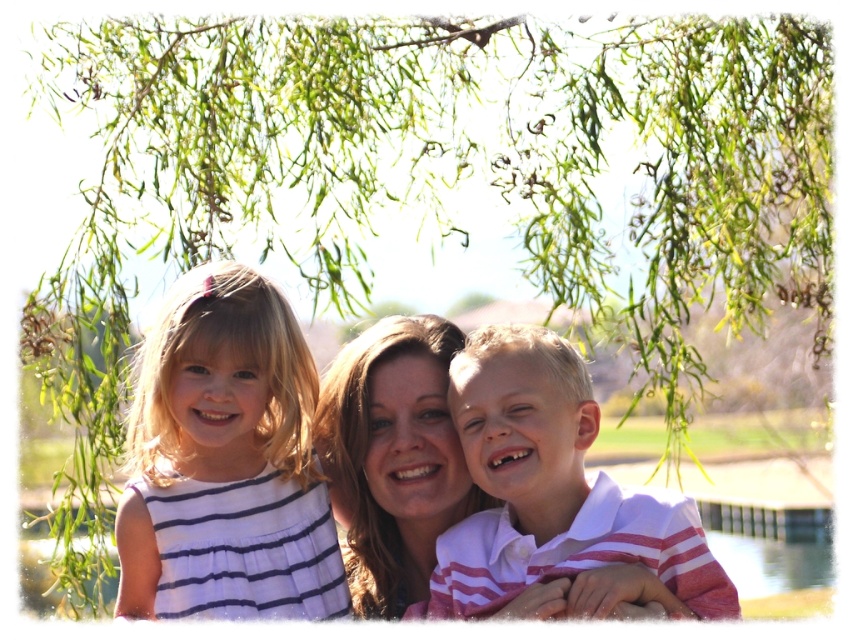
Question: Can you confirm if white striped dress at left is bigger than white striped shirt at center?

Choices:
 (A) no
 (B) yes

Answer: (A)

Question: Does white striped dress at left have a greater width compared to white striped shirt at center?

Choices:
 (A) no
 (B) yes

Answer: (A)

Question: Does white striped dress at left appear over white striped shirt at center?

Choices:
 (A) yes
 (B) no

Answer: (A)

Question: Which point is closer to the camera?

Choices:
 (A) white striped dress at left
 (B) white striped shirt at center

Answer: (B)

Question: Which of the following is the closest to the observer?

Choices:
 (A) white striped shirt at center
 (B) white striped dress at left

Answer: (A)